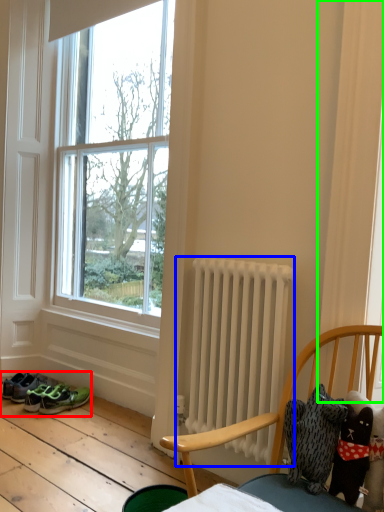
Question: Which is nearer to the footwear (highlighted by a red box)? radiator (highlighted by a blue box) or curtain (highlighted by a green box).

Choices:
 (A) radiator
 (B) curtain

Answer: (A)